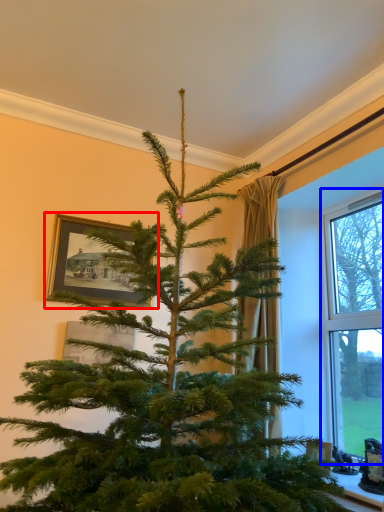
Question: Which of the following is the closest to the observer, picture frame (highlighted by a red box) or window (highlighted by a blue box)?

Choices:
 (A) picture frame
 (B) window

Answer: (B)